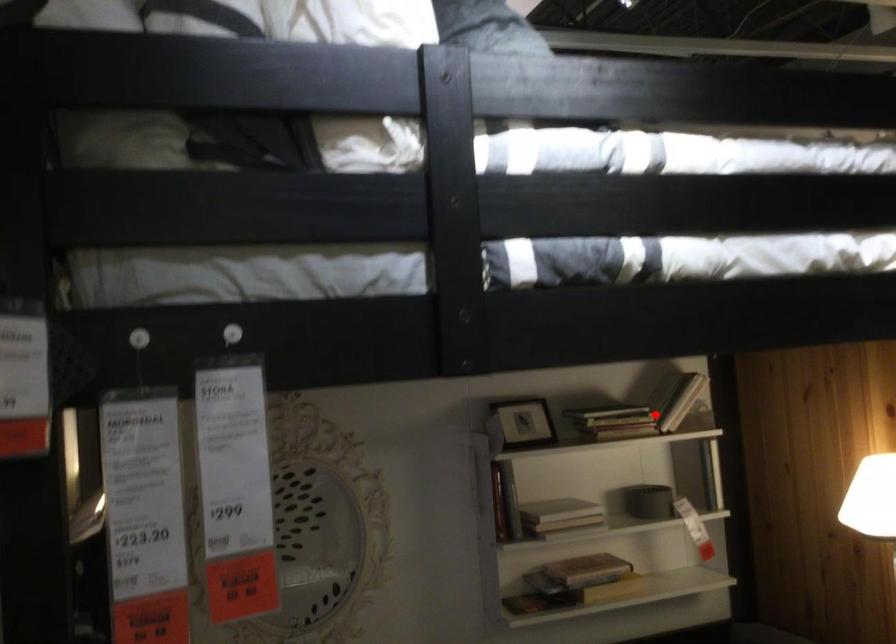
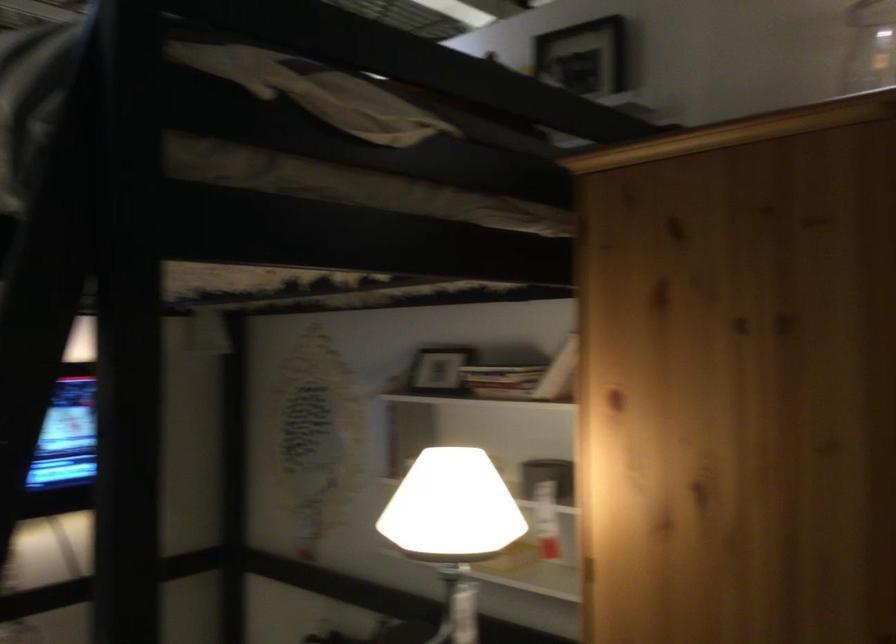
Find the pixel in the second image that matches the highlighted location in the first image.

(501, 379)